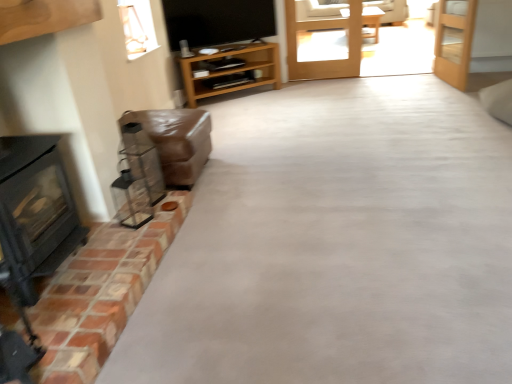
Question: From a real-world perspective, is light brown wooden table at center physically above brown leather couch at left?

Choices:
 (A) yes
 (B) no

Answer: (A)

Question: Can we say light brown wooden table at center lies outside brown leather couch at left?

Choices:
 (A) no
 (B) yes

Answer: (B)

Question: Does light brown wooden table at center have a smaller size compared to brown leather couch at left?

Choices:
 (A) yes
 (B) no

Answer: (B)

Question: Is light brown wooden table at center touching brown leather couch at left?

Choices:
 (A) no
 (B) yes

Answer: (A)

Question: Is light brown wooden table at center turned away from brown leather couch at left?

Choices:
 (A) yes
 (B) no

Answer: (B)

Question: From a real-world perspective, is light brown wooden table at center positioned under brown leather couch at left based on gravity?

Choices:
 (A) yes
 (B) no

Answer: (B)

Question: Considering the relative sizes of light brown wooden table at center and clear glass door at center, the second door in the right-to-left sequence, in the image provided, is light brown wooden table at center taller than clear glass door at center, the second door in the right-to-left sequence,?

Choices:
 (A) yes
 (B) no

Answer: (B)

Question: Can you confirm if light brown wooden table at center is wider than clear glass door at center, acting as the first door starting from the left?

Choices:
 (A) yes
 (B) no

Answer: (A)

Question: Is light brown wooden table at center not within clear glass door at center, the second door in the right-to-left sequence?

Choices:
 (A) no
 (B) yes

Answer: (B)

Question: Does light brown wooden table at center have a larger size compared to clear glass door at center, acting as the first door starting from the left?

Choices:
 (A) no
 (B) yes

Answer: (B)

Question: Is light brown wooden table at center positioned in front of clear glass door at center, the second door in the right-to-left sequence?

Choices:
 (A) yes
 (B) no

Answer: (B)

Question: From the image's perspective, is light brown wooden table at center above clear glass door at center, the second door in the right-to-left sequence?

Choices:
 (A) no
 (B) yes

Answer: (B)

Question: Is brown leather couch at left oriented towards wooden shelf at center?

Choices:
 (A) yes
 (B) no

Answer: (B)